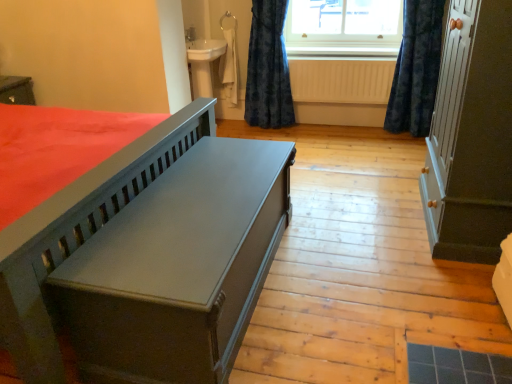
Based on the photo, what is the approximate width of velvet blue curtain at upper right, the 1th curtain when ordered from left to right?

10.30 inches.

The image size is (512, 384). I want to click on matte gray cabinet at right, so click(x=448, y=128).

What is the approximate height of clear glass window at upper center?

It is 16.55 inches.

What do you see at coordinates (416, 69) in the screenshot? I see `dark blue velvet curtain at upper right, the 1th curtain in the right-to-left sequence` at bounding box center [416, 69].

I want to click on matte gray bench at center, so click(x=148, y=257).

Describe the element at coordinates (148, 257) in the screenshot. This screenshot has width=512, height=384. I see `matte gray bench at center` at that location.

Image resolution: width=512 pixels, height=384 pixels. What are the coordinates of `velvet blue curtain at upper right, the 1th curtain when ordered from left to right` in the screenshot? It's located at (268, 68).

Does white ribbed radiator at center have a lesser width compared to matte gray bench at center?

Indeed, white ribbed radiator at center has a lesser width compared to matte gray bench at center.

Between white ribbed radiator at center and matte gray bench at center, which one has larger size?

With larger size is matte gray bench at center.

Find the location of a particular element. radiator above the matte gray bench at center (from the image's perspective) is located at coordinates (341, 81).

Which point is more forward, (x=359, y=88) or (x=120, y=166)?

The point (x=120, y=166) is in front.

Considering the relative positions of velvet blue curtain at upper right, the 2th curtain from the right, and dark blue velvet curtain at upper right, the 1th curtain in the right-to-left sequence, in the image provided, is velvet blue curtain at upper right, the 2th curtain from the right, to the right of dark blue velvet curtain at upper right, the 1th curtain in the right-to-left sequence, from the viewer's perspective?

No, velvet blue curtain at upper right, the 2th curtain from the right, is not to the right of dark blue velvet curtain at upper right, the 1th curtain in the right-to-left sequence.

From a real-world perspective, between velvet blue curtain at upper right, the 2th curtain from the right, and dark blue velvet curtain at upper right, the 1th curtain in the right-to-left sequence, who is vertically higher?

In real-world perspective, velvet blue curtain at upper right, the 2th curtain from the right, is above.

Locate an element on the screen. This screenshot has height=384, width=512. curtain above the dark blue velvet curtain at upper right, the 1th curtain in the right-to-left sequence (from a real-world perspective) is located at coordinates (268, 68).

Is point (264, 8) less distant than point (415, 92)?

No.

From the image's perspective, is clear glass window at upper center positioned above or below wooden at upper center?

clear glass window at upper center is above wooden at upper center.

Is clear glass window at upper center thinner than wooden at upper center?

Yes.

From a real-world perspective, between clear glass window at upper center and wooden at upper center, who is vertically lower?

wooden at upper center, from a real-world perspective.

Is the depth of clear glass window at upper center greater than that of wooden at upper center?

No, clear glass window at upper center is in front of wooden at upper center.

Where is `curtain on the right of the white ribbed radiator at center`? This screenshot has width=512, height=384. curtain on the right of the white ribbed radiator at center is located at coordinates (416, 69).

Does dark blue velvet curtain at upper right, marked as the 2th curtain in a left-to-right arrangement, come behind white ribbed radiator at center?

No.

Can you confirm if dark blue velvet curtain at upper right, marked as the 2th curtain in a left-to-right arrangement, is wider than white ribbed radiator at center?

Yes.

This screenshot has height=384, width=512. Find the location of `screen door lying in front of the velvet blue curtain at upper right, the 1th curtain when ordered from left to right`. screen door lying in front of the velvet blue curtain at upper right, the 1th curtain when ordered from left to right is located at coordinates (448, 128).

Is the surface of matte gray cabinet at right in direct contact with velvet blue curtain at upper right, the 2th curtain from the right?

No, matte gray cabinet at right is not making contact with velvet blue curtain at upper right, the 2th curtain from the right.

Consider the image. Is matte gray cabinet at right aimed at velvet blue curtain at upper right, the 2th curtain from the right?

No, matte gray cabinet at right is not oriented towards velvet blue curtain at upper right, the 2th curtain from the right.

Is matte gray cabinet at right inside or outside of velvet blue curtain at upper right, the 1th curtain when ordered from left to right?

matte gray cabinet at right is not inside velvet blue curtain at upper right, the 1th curtain when ordered from left to right, it's outside.

From a real-world perspective, between white ribbed radiator at center and dark blue velvet curtain at upper right, marked as the 2th curtain in a left-to-right arrangement, who is vertically lower?

white ribbed radiator at center.

Would you consider white ribbed radiator at center to be distant from dark blue velvet curtain at upper right, the 1th curtain in the right-to-left sequence?

That's not correct — white ribbed radiator at center is a little close to dark blue velvet curtain at upper right, the 1th curtain in the right-to-left sequence.

Is white ribbed radiator at center looking in the opposite direction of dark blue velvet curtain at upper right, marked as the 2th curtain in a left-to-right arrangement?

No, dark blue velvet curtain at upper right, marked as the 2th curtain in a left-to-right arrangement, is not at the back of white ribbed radiator at center.

Considering the relative sizes of white ribbed radiator at center and dark blue velvet curtain at upper right, marked as the 2th curtain in a left-to-right arrangement, in the image provided, is white ribbed radiator at center thinner than dark blue velvet curtain at upper right, marked as the 2th curtain in a left-to-right arrangement,?

Yes.

Does point (396, 116) come closer to viewer compared to point (266, 35)?

No, (396, 116) is further to viewer.

In terms of height, does dark blue velvet curtain at upper right, the 1th curtain in the right-to-left sequence, look taller or shorter compared to velvet blue curtain at upper right, the 1th curtain when ordered from left to right?

dark blue velvet curtain at upper right, the 1th curtain in the right-to-left sequence, is shorter than velvet blue curtain at upper right, the 1th curtain when ordered from left to right.

Visually, is dark blue velvet curtain at upper right, the 1th curtain in the right-to-left sequence, positioned to the left or to the right of velvet blue curtain at upper right, the 2th curtain from the right?

From the image, it's evident that dark blue velvet curtain at upper right, the 1th curtain in the right-to-left sequence, is to the right of velvet blue curtain at upper right, the 2th curtain from the right.

At what (x,y) coordinates should I click in order to perform the action: click on bed below the white ribbed radiator at center (from the image's perspective). Please return your answer as a coordinate pair (x, y). The height and width of the screenshot is (384, 512). Looking at the image, I should click on (148, 257).

Image resolution: width=512 pixels, height=384 pixels. I want to click on curtain located in front of the velvet blue curtain at upper right, the 1th curtain when ordered from left to right, so click(x=416, y=69).

Considering their positions, is dark blue velvet curtain at upper right, marked as the 2th curtain in a left-to-right arrangement, positioned closer to clear glass window at upper center than wooden at upper center?

wooden at upper center is positioned closer to the anchor clear glass window at upper center.

Based on their spatial positions, is matte gray cabinet at right or white ribbed radiator at center closer to matte gray bench at center?

matte gray cabinet at right.

Based on the photo, from the image, which object appears to be nearer to matte gray cabinet at right, clear glass window at upper center or white ribbed radiator at center?

white ribbed radiator at center lies closer to matte gray cabinet at right than the other object.

Looking at the image, which one is located further to white ribbed radiator at center, dark blue velvet curtain at upper right, marked as the 2th curtain in a left-to-right arrangement, or wooden at upper center?

dark blue velvet curtain at upper right, marked as the 2th curtain in a left-to-right arrangement, lies further to white ribbed radiator at center than the other object.

Which object lies further to the anchor point wooden at upper center, matte gray bench at center or white ribbed radiator at center?

Among the two, matte gray bench at center is located further to wooden at upper center.

Estimate the real-world distances between objects in this image. Which object is further from white ribbed radiator at center, velvet blue curtain at upper right, the 1th curtain when ordered from left to right, or matte gray bench at center?

matte gray bench at center.

Estimate the real-world distances between objects in this image. Which object is closer to wooden at upper center, velvet blue curtain at upper right, the 1th curtain when ordered from left to right, or matte gray cabinet at right?

Based on the image, velvet blue curtain at upper right, the 1th curtain when ordered from left to right, appears to be nearer to wooden at upper center.

Looking at the image, which one is located closer to velvet blue curtain at upper right, the 2th curtain from the right, white ribbed radiator at center or matte gray bench at center?

white ribbed radiator at center is positioned closer to the anchor velvet blue curtain at upper right, the 2th curtain from the right.

I want to click on screen door located between matte gray bench at center and wooden at upper center in the depth direction, so click(x=448, y=128).

Find the location of a particular element. The image size is (512, 384). radiator between matte gray cabinet at right and wooden at upper center along the z-axis is located at coordinates (341, 81).

Find the location of a particular element. window situated between velvet blue curtain at upper right, the 2th curtain from the right, and dark blue velvet curtain at upper right, marked as the 2th curtain in a left-to-right arrangement, from left to right is located at coordinates (343, 27).

What are the coordinates of `curtain positioned between matte gray bench at center and velvet blue curtain at upper right, the 2th curtain from the right, from near to far` in the screenshot? It's located at (416, 69).